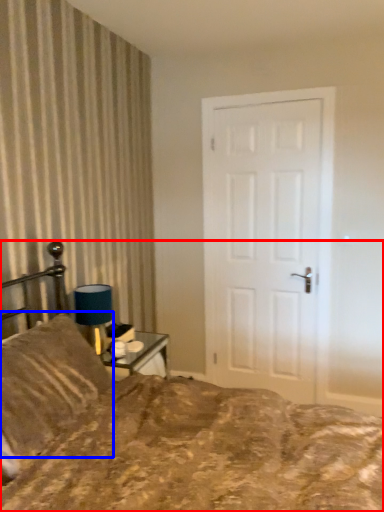
Question: Which object is further to the camera taking this photo, bed (highlighted by a red box) or pillow (highlighted by a blue box)?

Choices:
 (A) bed
 (B) pillow

Answer: (B)